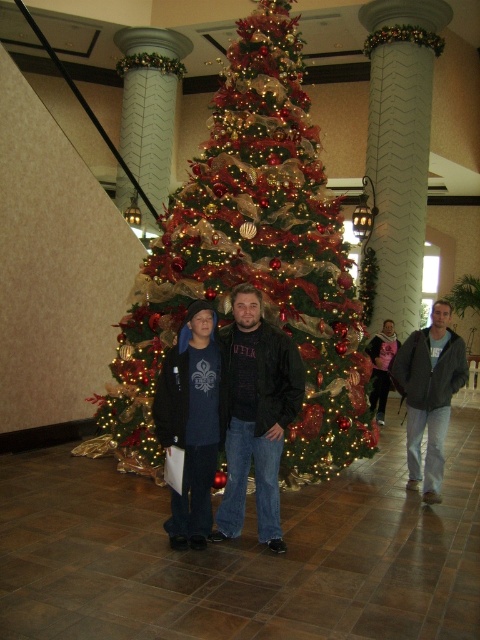
Between black matte jacket at center and dark blue fleece jacket at center, which one has less height?

dark blue fleece jacket at center is shorter.

Who is positioned more to the left, black matte jacket at center or dark blue fleece jacket at center?

From the viewer's perspective, dark blue fleece jacket at center appears more on the left side.

Between point (235, 420) and point (204, 522), which one is positioned in front?

Point (204, 522)

The width and height of the screenshot is (480, 640). I want to click on black matte jacket at center, so click(x=255, y=413).

Can you confirm if dark blue fleece jacket at center is wider than gray cotton jacket at center?

In fact, dark blue fleece jacket at center might be narrower than gray cotton jacket at center.

Which is in front, point (196, 490) or point (441, 470)?

Point (196, 490) is in front.

Describe the element at coordinates (192, 420) in the screenshot. This screenshot has height=640, width=480. I see `dark blue fleece jacket at center` at that location.

Locate an element on the screen. The image size is (480, 640). dark blue fleece jacket at center is located at coordinates (192, 420).

Between point (183, 273) and point (157, 406), which one is positioned behind?

The point (183, 273) is behind.

Describe the element at coordinates (252, 262) in the screenshot. I see `green textured christmas tree at center` at that location.

Image resolution: width=480 pixels, height=640 pixels. I want to click on green textured christmas tree at center, so (252, 262).